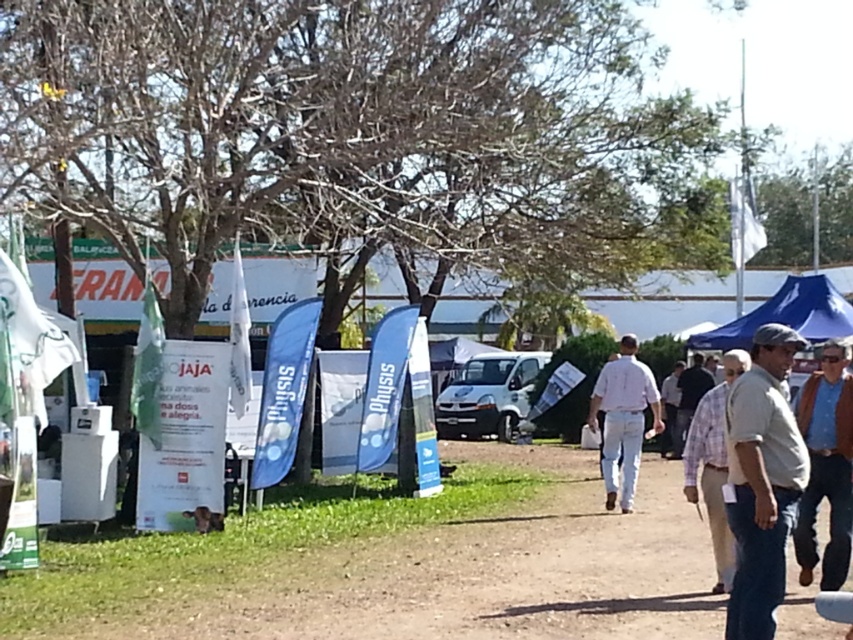
Question: Which point is closer to the camera?

Choices:
 (A) dark gray shirt at center
 (B) brown leather jacket at lower right

Answer: (B)

Question: Does brown dirt track at center have a smaller size compared to blue fabric canopy at center?

Choices:
 (A) no
 (B) yes

Answer: (B)

Question: Is brown dirt track at center to the right of brown leather jacket at lower right from the viewer's perspective?

Choices:
 (A) no
 (B) yes

Answer: (A)

Question: Which of the following is the farthest from the observer?

Choices:
 (A) light brown cotton shirt at center
 (B) blue fabric canopy at center
 (C) white cotton shirt at center
 (D) light brown shirt at center

Answer: (D)

Question: Which is nearer to the light brown cotton shirt at center?

Choices:
 (A) white cotton shirt at center
 (B) gray cotton shirt at right
 (C) dark gray shirt at center
 (D) brown leather jacket at lower right

Answer: (D)

Question: Can you confirm if gray cotton shirt at right is bigger than white cotton shirt at center?

Choices:
 (A) yes
 (B) no

Answer: (A)